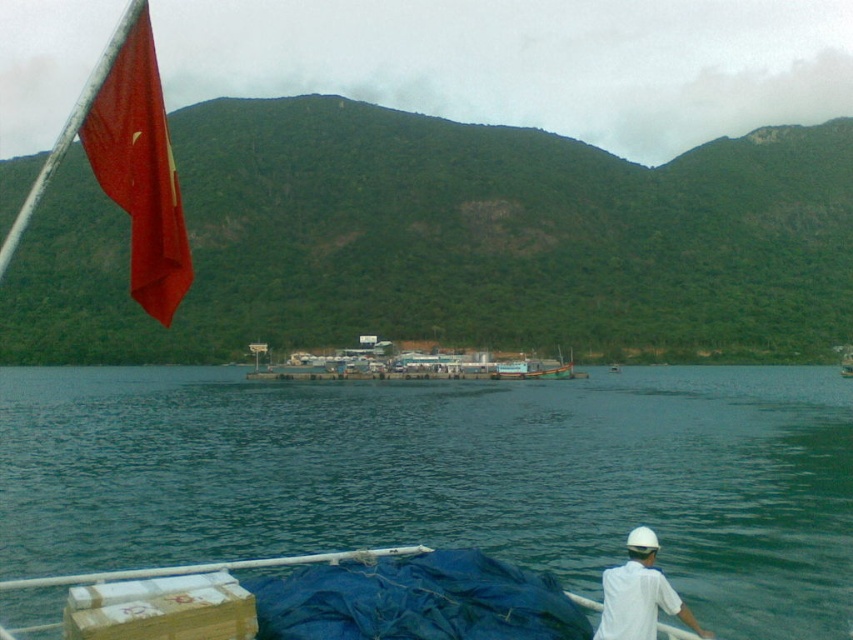
Question: Which of the following is the farthest from the observer?

Choices:
 (A) red matte flag at upper left
 (B) metallic gray dock at center
 (C) green water at center
 (D) white matte shirt at lower right

Answer: (B)

Question: Where is green water at center located in relation to red matte flag at upper left in the image?

Choices:
 (A) below
 (B) above

Answer: (A)

Question: Which point is farther from the camera taking this photo?

Choices:
 (A) (276, 376)
 (B) (154, 502)

Answer: (A)

Question: Which of the following is the farthest from the observer?

Choices:
 (A) (531, 362)
 (B) (184, 468)
 (C) (616, 588)

Answer: (A)

Question: Does red matte flag at upper left have a greater width compared to white matte shirt at lower right?

Choices:
 (A) no
 (B) yes

Answer: (B)

Question: Can you confirm if green water at center is bigger than white matte shirt at lower right?

Choices:
 (A) yes
 (B) no

Answer: (A)